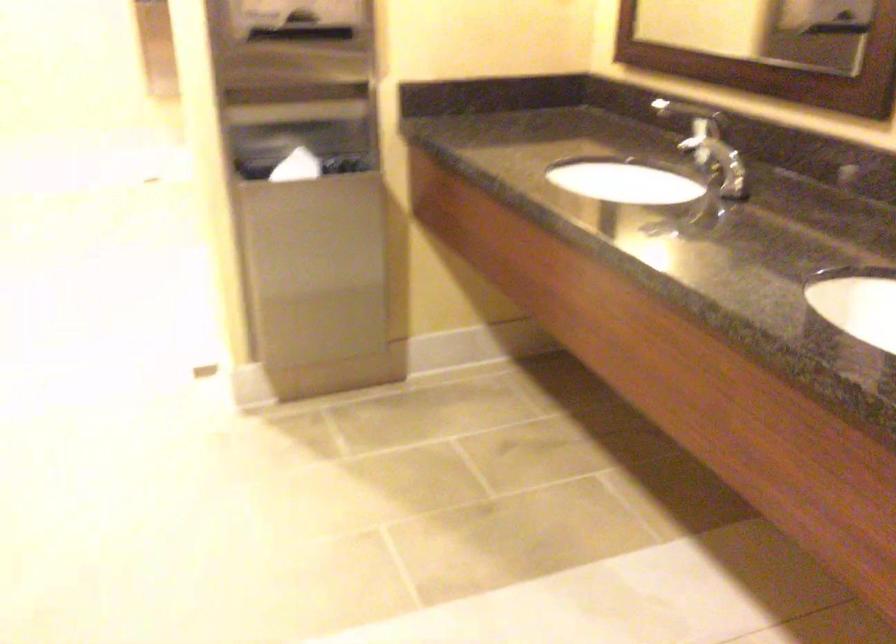
This screenshot has width=896, height=644. What do you see at coordinates (305, 144) in the screenshot?
I see `the trash can opening` at bounding box center [305, 144].